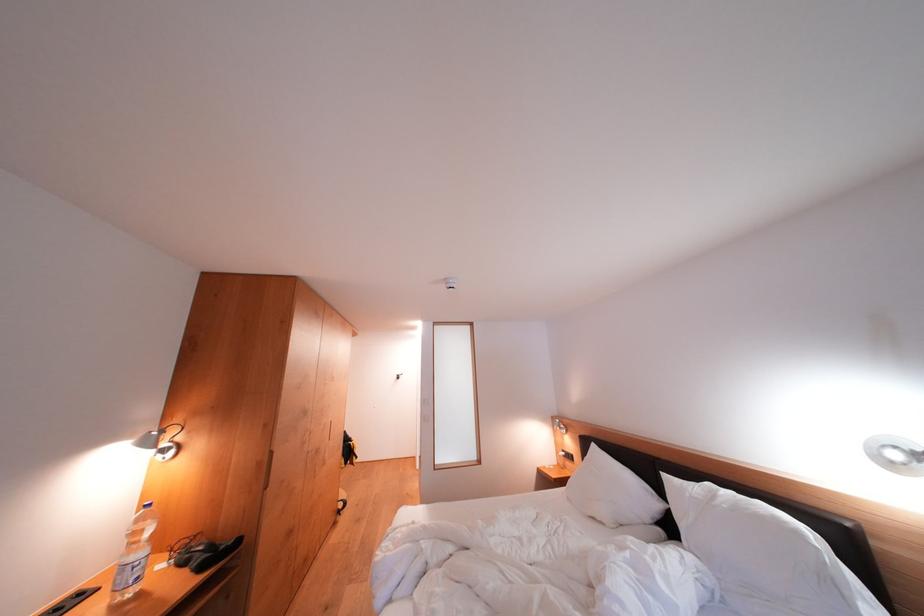
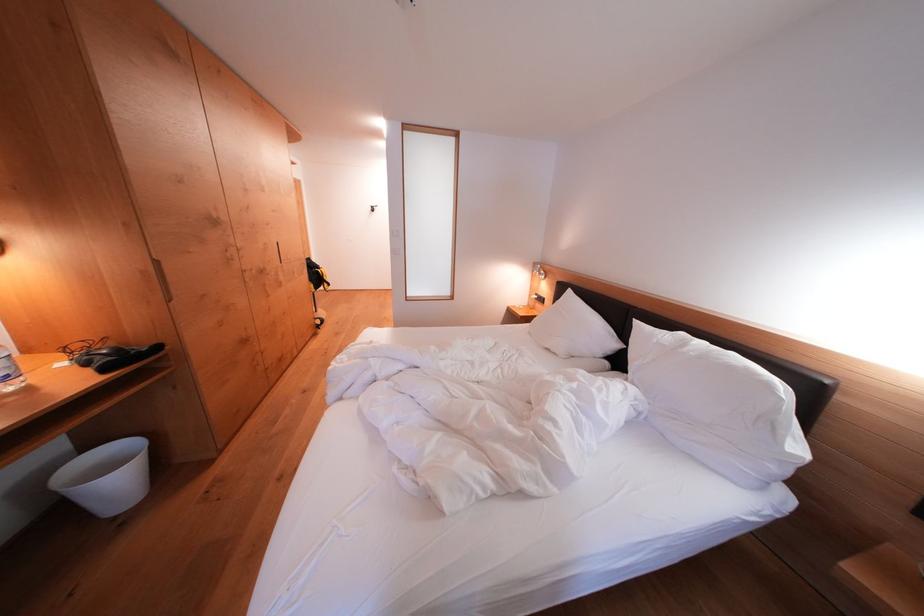
Question: Based on the continuous images, in which direction is the camera rotating? Reply with the corresponding letter.

Choices:
 (A) Left
 (B) Right
 (C) Up
 (D) Down

Answer: (D)